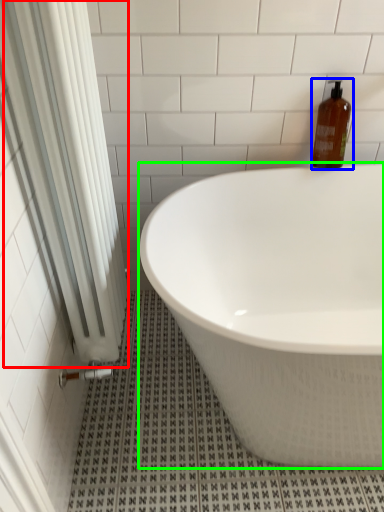
Question: Which object is the farthest from shower curtain (highlighted by a red box)? Choose among these: bottle (highlighted by a blue box) or bathtub (highlighted by a green box).

Choices:
 (A) bottle
 (B) bathtub

Answer: (A)